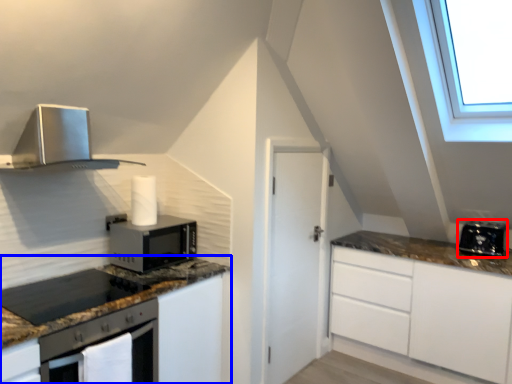
Question: Among these objects, which one is nearest to the camera, toaster (highlighted by a red box) or cabinetry (highlighted by a blue box)?

Choices:
 (A) toaster
 (B) cabinetry

Answer: (B)